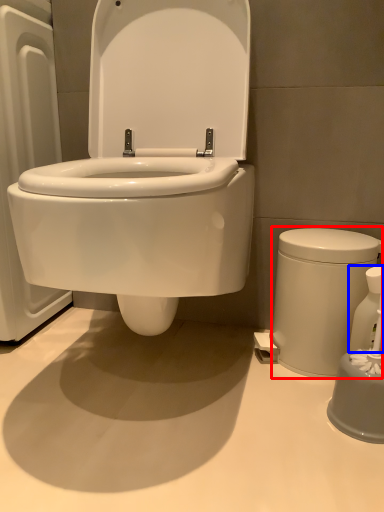
Question: Among these objects, which one is farthest to the camera, porcelain (highlighted by a red box) or soap dispenser (highlighted by a blue box)?

Choices:
 (A) porcelain
 (B) soap dispenser

Answer: (A)